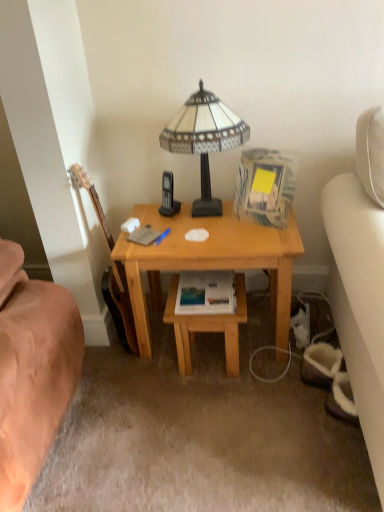
Question: Could you tell me if light brown wood table at center is turned towards stained glass lampshade at center?

Choices:
 (A) yes
 (B) no

Answer: (B)

Question: Is light brown wood table at center positioned before stained glass lampshade at center?

Choices:
 (A) yes
 (B) no

Answer: (B)

Question: Does light brown wood table at center lie behind stained glass lampshade at center?

Choices:
 (A) yes
 (B) no

Answer: (A)

Question: Can you confirm if light brown wood table at center is positioned to the right of stained glass lampshade at center?

Choices:
 (A) yes
 (B) no

Answer: (A)

Question: Are light brown wood table at center and stained glass lampshade at center beside each other?

Choices:
 (A) no
 (B) yes

Answer: (A)

Question: From a real-world perspective, is light brown wood table at center on top of stained glass lampshade at center?

Choices:
 (A) yes
 (B) no

Answer: (B)

Question: Does wooden acoustic guitar at left lie behind matte paper paperback book at center?

Choices:
 (A) no
 (B) yes

Answer: (A)

Question: Is wooden acoustic guitar at left in front of matte paper paperback book at center?

Choices:
 (A) no
 (B) yes

Answer: (B)

Question: Is wooden acoustic guitar at left bigger than matte paper paperback book at center?

Choices:
 (A) no
 (B) yes

Answer: (B)

Question: Is wooden acoustic guitar at left beside matte paper paperback book at center?

Choices:
 (A) no
 (B) yes

Answer: (A)

Question: From a real-world perspective, is wooden acoustic guitar at left positioned over matte paper paperback book at center based on gravity?

Choices:
 (A) no
 (B) yes

Answer: (B)

Question: Does wooden acoustic guitar at left have a lesser height compared to matte paper paperback book at center?

Choices:
 (A) yes
 (B) no

Answer: (B)

Question: Is matte paper paperback book at center shorter than stained glass lampshade at center?

Choices:
 (A) no
 (B) yes

Answer: (B)